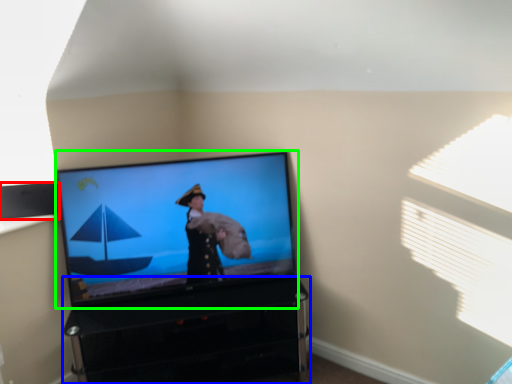
Question: Which object is positioned closest to speaker (highlighted by a red box)? Select from furniture (highlighted by a blue box) and television (highlighted by a green box).

Choices:
 (A) furniture
 (B) television

Answer: (B)